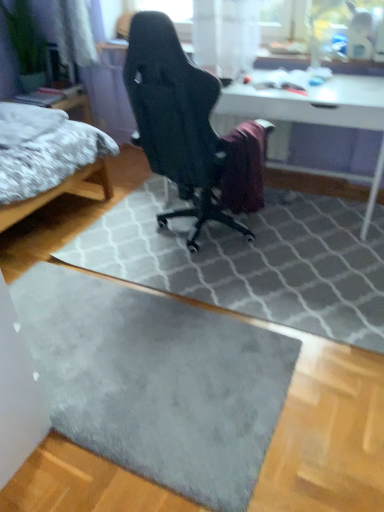
What is the approximate width of black mesh chair at center?

It is 30.40 inches.

Locate an element on the screen. gray soft rug at lower center is located at coordinates (156, 382).

The height and width of the screenshot is (512, 384). I want to click on black mesh chair at center, so click(x=186, y=127).

Looking at their sizes, would you say white glossy table at center is wider or thinner than gray fluffy bed at left?

white glossy table at center is thinner than gray fluffy bed at left.

How much distance is there between white glossy table at center and gray fluffy bed at left?

white glossy table at center and gray fluffy bed at left are 3.99 feet apart.

Can you confirm if white glossy table at center is taller than gray fluffy bed at left?

No, white glossy table at center is not taller than gray fluffy bed at left.

This screenshot has width=384, height=512. Find the location of `bed that appears on the left of white glossy table at center`. bed that appears on the left of white glossy table at center is located at coordinates (60, 179).

Is gray fluffy bed at left looking in the opposite direction of black mesh chair at center?

No, gray fluffy bed at left's orientation is not away from black mesh chair at center.

Considering the relative sizes of gray fluffy bed at left and black mesh chair at center in the image provided, is gray fluffy bed at left smaller than black mesh chair at center?

No.

Is gray fluffy bed at left with black mesh chair at center?

There is a gap between gray fluffy bed at left and black mesh chair at center.

Does gray fluffy bed at left appear on the right side of black mesh chair at center?

No, gray fluffy bed at left is not to the right of black mesh chair at center.

Is black mesh chair at center to the left of gray soft rug at lower center from the viewer's perspective?

In fact, black mesh chair at center is to the right of gray soft rug at lower center.

Is black mesh chair at center shorter than gray soft rug at lower center?

No, black mesh chair at center is not shorter than gray soft rug at lower center.

Is black mesh chair at center positioned far away from gray soft rug at lower center?

They are positioned close to each other.

Is black mesh chair at center wider or thinner than gray soft rug at lower center?

In the image, black mesh chair at center appears to be more narrow than gray soft rug at lower center.

From a real-world perspective, which object rests below the other?

From a 3D spatial view, gray soft rug at lower center is below.

Does gray fluffy bed at left appear on the right side of gray soft rug at lower center?

In fact, gray fluffy bed at left is to the left of gray soft rug at lower center.

Between gray fluffy bed at left and gray soft rug at lower center, which one has larger size?

gray fluffy bed at left.

Can you tell me how much gray fluffy bed at left and gray soft rug at lower center differ in facing direction?

gray fluffy bed at left and gray soft rug at lower center are facing 0.641 degrees away from each other.

How much distance is there between gray fluffy bed at left and white glossy table at center?

A distance of 1.22 meters exists between gray fluffy bed at left and white glossy table at center.

Is gray fluffy bed at left positioned with its back to white glossy table at center?

No, white glossy table at center is not at the back of gray fluffy bed at left.

What are the coordinates of `table behind the gray fluffy bed at left` in the screenshot? It's located at (321, 116).

Does point (13, 176) appear closer or farther from the camera than point (322, 98)?

Point (13, 176) is positioned farther from the camera compared to point (322, 98).

Are white glossy table at center and black mesh chair at center making contact?

They are not placed beside each other.

Does white glossy table at center have a greater height compared to black mesh chair at center?

No.

Is white glossy table at center in front of or behind black mesh chair at center in the image?

white glossy table at center is behind black mesh chair at center.

From a real-world perspective, is white glossy table at center beneath gray soft rug at lower center?

Incorrect, from a real-world perspective, white glossy table at center is higher than gray soft rug at lower center.

Can you see white glossy table at center touching gray soft rug at lower center?

white glossy table at center is not next to gray soft rug at lower center, and they're not touching.

Is white glossy table at center at the left side of gray soft rug at lower center?

No.

Is white glossy table at center oriented towards gray soft rug at lower center?

Yes, white glossy table at center is turned towards gray soft rug at lower center.

Identify the location of table above the gray fluffy bed at left (from the image's perspective). This screenshot has width=384, height=512. (321, 116).

Locate an element on the screen. Image resolution: width=384 pixels, height=512 pixels. chair above the gray fluffy bed at left (from a real-world perspective) is located at coordinates pos(186,127).

Estimate the real-world distances between objects in this image. Which object is further from black mesh chair at center, white glossy table at center or gray soft rug at lower center?

The object further to black mesh chair at center is gray soft rug at lower center.

Looking at the image, which one is located closer to gray fluffy bed at left, gray soft rug at lower center or white glossy table at center?

The object closer to gray fluffy bed at left is gray soft rug at lower center.

Based on their spatial positions, is gray fluffy bed at left or black mesh chair at center closer to white glossy table at center?

black mesh chair at center is closer to white glossy table at center.

From the image, which object appears to be farther from gray soft rug at lower center, white glossy table at center or black mesh chair at center?

white glossy table at center is positioned further to the anchor gray soft rug at lower center.

When comparing their distances from white glossy table at center, does gray fluffy bed at left or gray soft rug at lower center seem closer?

gray fluffy bed at left is closer to white glossy table at center.

In the scene shown: From the image, which object appears to be farther from gray soft rug at lower center, gray fluffy bed at left or black mesh chair at center?

gray fluffy bed at left.

Considering their positions, is black mesh chair at center positioned further to white glossy table at center than gray fluffy bed at left?

gray fluffy bed at left is further to white glossy table at center.

Considering their positions, is black mesh chair at center positioned further to gray soft rug at lower center than white glossy table at center?

The object further to gray soft rug at lower center is white glossy table at center.

At what (x,y) coordinates should I click in order to perform the action: click on chair between gray fluffy bed at left and white glossy table at center from left to right. Please return your answer as a coordinate pair (x, y). Looking at the image, I should click on (186, 127).

Identify the location of doormat between gray fluffy bed at left and black mesh chair at center from left to right. Image resolution: width=384 pixels, height=512 pixels. (156, 382).

Where is `doormat situated between gray fluffy bed at left and white glossy table at center from left to right`? This screenshot has height=512, width=384. doormat situated between gray fluffy bed at left and white glossy table at center from left to right is located at coordinates pos(156,382).

I want to click on chair between white glossy table at center and gray soft rug at lower center vertically, so click(x=186, y=127).